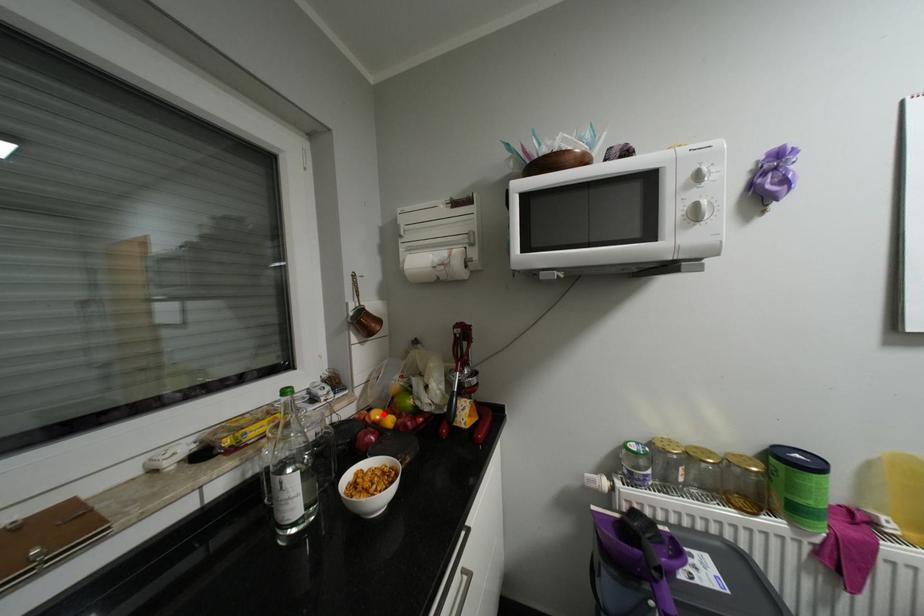
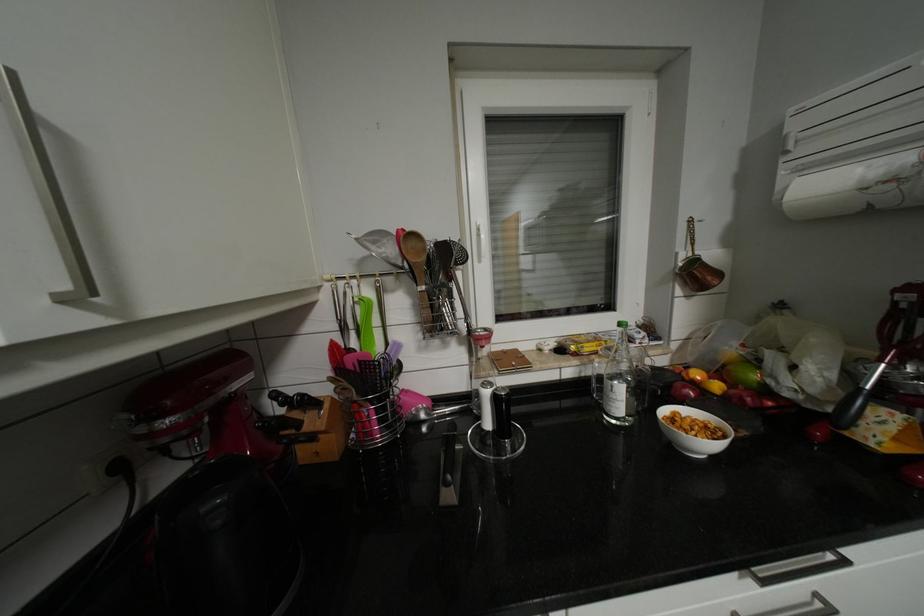
The point at the highlighted location is marked in the first image. Where is the corresponding point in the second image?

(704, 374)